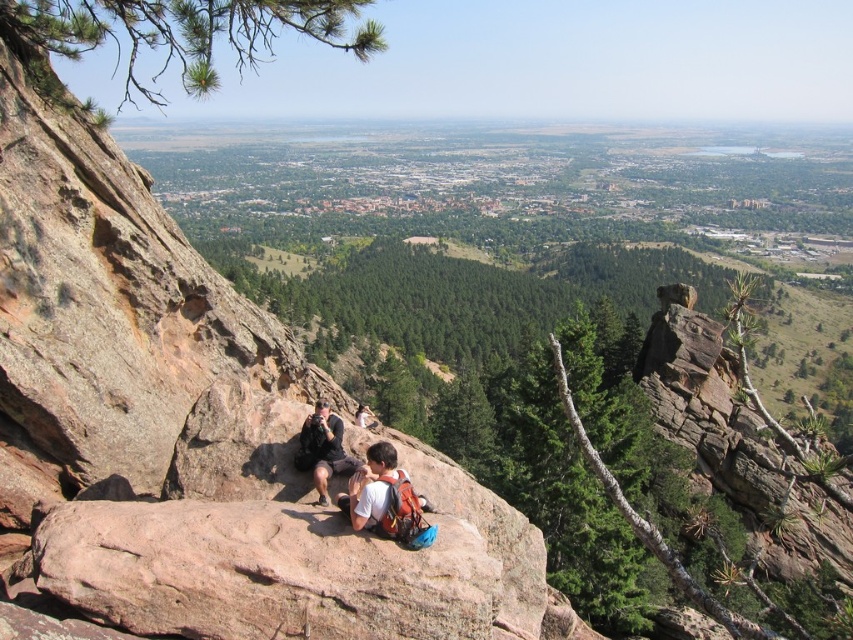
Is rusty rock cliff at center smaller than black fabric camera at center?

No, rusty rock cliff at center is not smaller than black fabric camera at center.

Does rusty rock cliff at center have a larger size compared to black fabric camera at center?

Indeed, rusty rock cliff at center has a larger size compared to black fabric camera at center.

Locate an element on the screen. The image size is (853, 640). rusty rock cliff at center is located at coordinates (125, 336).

Who is more distant from viewer, (339, 506) or (334, 417)?

The point (334, 417) is more distant.

Which is below, matte brown backpack at center or black fabric camera at center?

matte brown backpack at center is lower down.

Where is `matte brown backpack at center`? This screenshot has height=640, width=853. matte brown backpack at center is located at coordinates pyautogui.click(x=381, y=496).

Does rusty rock cliff at center have a larger size compared to matte brown backpack at center?

Correct, rusty rock cliff at center is larger in size than matte brown backpack at center.

Between point (488, 538) and point (363, 504), which one is positioned in front?

Point (363, 504)

This screenshot has width=853, height=640. I want to click on rusty rock cliff at center, so click(x=125, y=336).